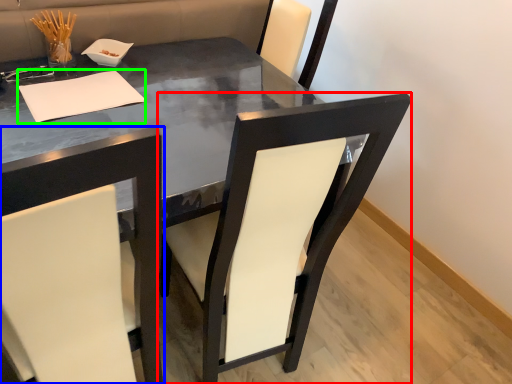
Question: Considering the real-world distances, which object is closest to chair (highlighted by a red box)? chair (highlighted by a blue box) or notepad (highlighted by a green box).

Choices:
 (A) chair
 (B) notepad

Answer: (A)